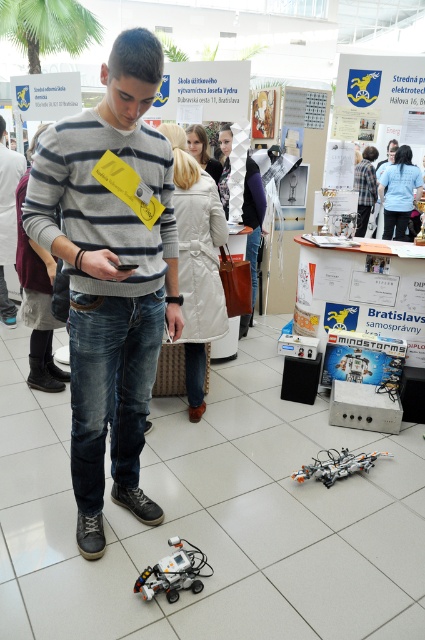
Question: Which point is farther to the camera?

Choices:
 (A) (362, 234)
 (B) (161, 220)
 (C) (195, 550)
 (D) (6, 198)

Answer: (A)

Question: Does white plastic robot at lower center come in front of blue fabric shirt at upper center?

Choices:
 (A) no
 (B) yes

Answer: (B)

Question: Which point is closer to the camera?

Choices:
 (A) jeans at center
 (B) striped knit sweater at center
 (C) white plastic robot at lower center
 (D) orange metallic robot at lower center

Answer: (B)

Question: Does orange metallic robot at lower center appear on the right side of blue striped sweater at center?

Choices:
 (A) no
 (B) yes

Answer: (A)

Question: Is striped knit sweater at center in front of orange metallic robot at lower center?

Choices:
 (A) no
 (B) yes

Answer: (B)

Question: Which object appears farthest from the camera in this image?

Choices:
 (A) blue striped sweater at center
 (B) blue fabric shirt at upper center
 (C) striped knit sweater at center

Answer: (B)